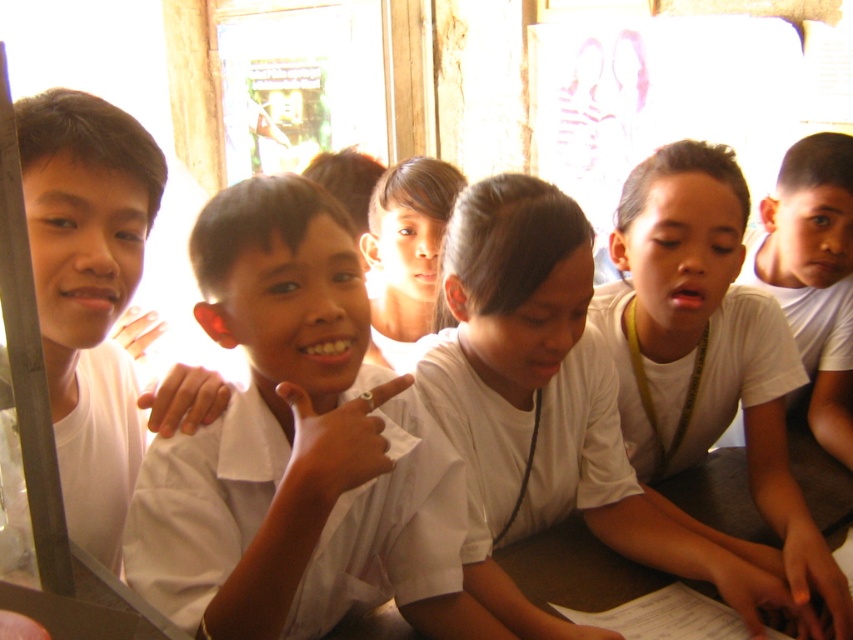
Question: Which of the following is the closest to the observer?

Choices:
 (A) white matte shirt at left
 (B) white matte shirt at right

Answer: (A)

Question: Among these points, which one is nearest to the camera?

Choices:
 (A) (724, 282)
 (B) (84, 321)
 (C) (820, 404)

Answer: (B)

Question: Does white matte shirt at center have a larger size compared to white matte shirt at left?

Choices:
 (A) no
 (B) yes

Answer: (B)

Question: Which object is positioned farthest from the smooth skin face at center?

Choices:
 (A) white matte shirt at center
 (B) white matte shirt at right
 (C) white matte shirt at left

Answer: (B)

Question: Can you confirm if white matte shirt at left is thinner than smooth skin face at center?

Choices:
 (A) no
 (B) yes

Answer: (B)

Question: Can you confirm if white matte shirt at center is positioned to the left of smooth skin face at center?

Choices:
 (A) no
 (B) yes

Answer: (A)